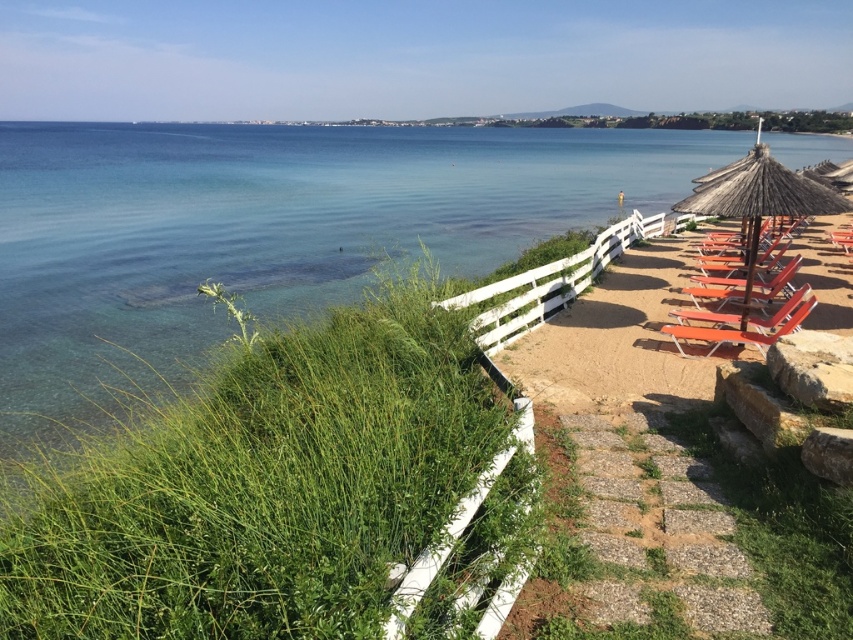
Describe the element at coordinates (268, 230) in the screenshot. I see `clear blue water at upper left` at that location.

How much distance is there between clear blue water at upper left and orange plastic beach chair at right?

The distance of clear blue water at upper left from orange plastic beach chair at right is 135.84 feet.

Which is behind, point (15, 321) or point (791, 321)?

Point (15, 321)

The height and width of the screenshot is (640, 853). Identify the location of clear blue water at upper left. (268, 230).

This screenshot has width=853, height=640. Describe the element at coordinates (268, 230) in the screenshot. I see `clear blue water at upper left` at that location.

Find the location of a particular element. This screenshot has width=853, height=640. clear blue water at upper left is located at coordinates (268, 230).

Is orange plastic beach chair at right below matte orange beach chair at right?

Correct, orange plastic beach chair at right is located below matte orange beach chair at right.

Can you confirm if orange plastic beach chair at right is positioned to the left of matte orange beach chair at right?

Yes, orange plastic beach chair at right is to the left of matte orange beach chair at right.

Does point (665, 332) come closer to viewer compared to point (706, 289)?

Yes, it is in front of point (706, 289).

The image size is (853, 640). I want to click on orange plastic beach chair at right, so click(x=746, y=330).